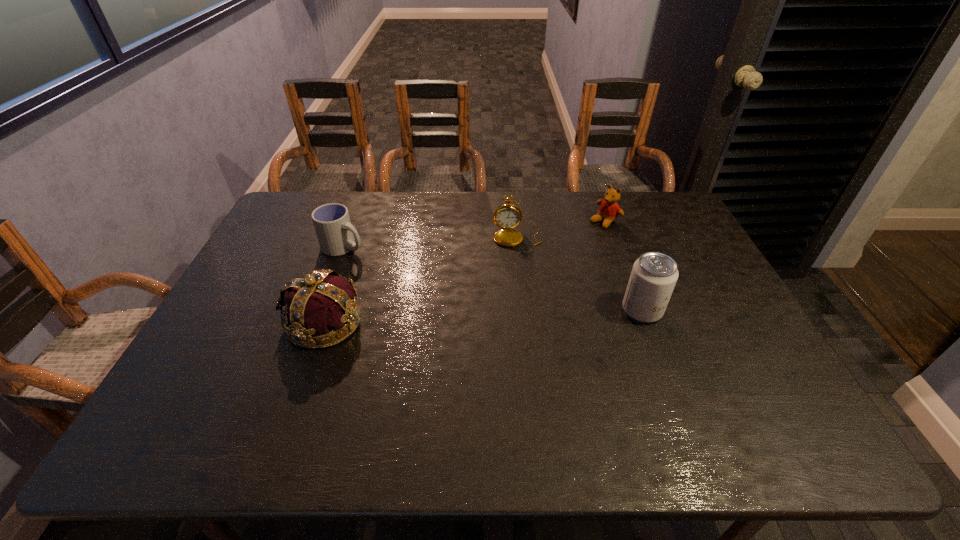
You are a GUI agent. You are given a task and a screenshot of the screen. Output one action in this format:
    pyautogui.click(x=<x>, y=<y>)
    Task: Click on the free point between the third object from left to right and the teddy bear
    This screenshot has width=960, height=540.
    Given the screenshot: What is the action you would take?
    pyautogui.click(x=561, y=229)

I want to click on free space between the teddy bear and the soda can, so click(623, 266).

This screenshot has height=540, width=960. What are the coordinates of `free space between the crown and the teddy bear` in the screenshot? It's located at (465, 272).

Image resolution: width=960 pixels, height=540 pixels. Find the location of `object identified as the third closest to the teddy bear`. object identified as the third closest to the teddy bear is located at coordinates (335, 233).

The width and height of the screenshot is (960, 540). I want to click on object identified as the third closest to the crown, so click(654, 275).

Find the location of a particular element. blank space that satisfies the following two spatial constraints: 1. on the back side of the pocket watch; 2. on the left side of the teddy bear is located at coordinates (516, 221).